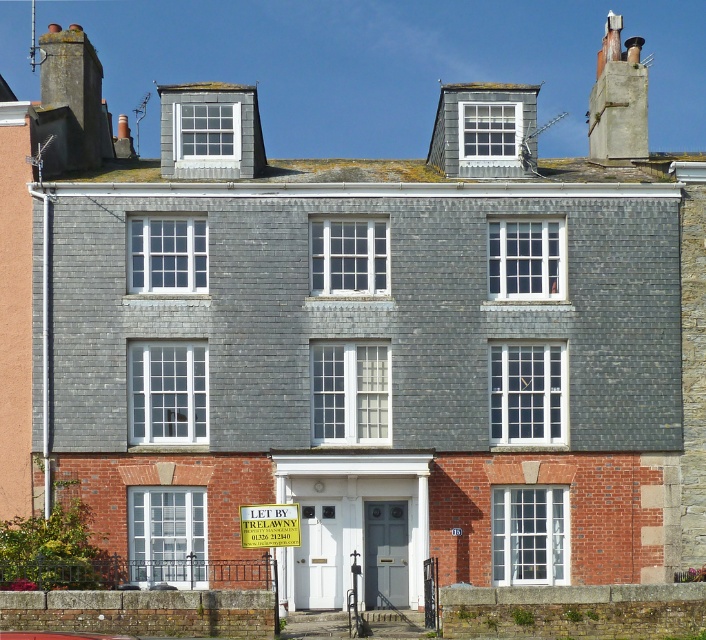
You are a delivery person trying to find the correct entrance to this building. The building has a smooth stone chimney at upper left and a yellow paper sign at center. Which object is closer to the entrance doors?

The yellow paper sign at center is closer to the entrance doors because it is located at the center, while the smooth stone chimney at upper left is positioned higher up and likely farther away from the entrance area.